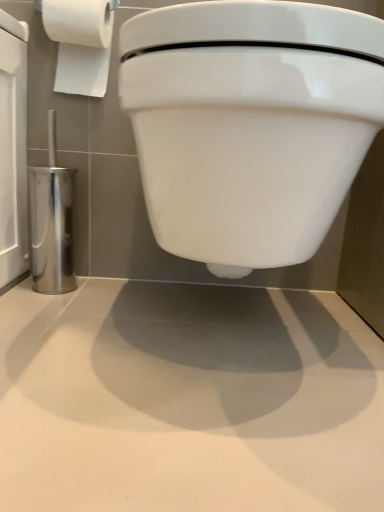
Where is `white paper at upper left`? The image size is (384, 512). white paper at upper left is located at coordinates (80, 42).

What do you see at coordinates (80, 42) in the screenshot? The width and height of the screenshot is (384, 512). I see `white paper at upper left` at bounding box center [80, 42].

Describe the element at coordinates (250, 124) in the screenshot. The width and height of the screenshot is (384, 512). I see `white glossy toilet at center` at that location.

Locate an element on the screen. white glossy toilet at center is located at coordinates (250, 124).

In order to face white glossy toilet at center, should I rotate leftwards or rightwards?

It's best to rotate right around 6.120 degrees.

I want to click on white paper at upper left, so click(x=80, y=42).

Considering the positions of objects white glossy toilet at center and white paper at upper left in the image provided, who is more to the left, white glossy toilet at center or white paper at upper left?

white paper at upper left is more to the left.

Which object is further away from the camera, white glossy toilet at center or white paper at upper left?

white paper at upper left is more distant.

From the picture: Which point is more distant from viewer, [235,96] or [90,19]?

The point [90,19] is behind.

From the image's perspective, is white glossy toilet at center above or below white paper at upper left?

white glossy toilet at center is situated lower than white paper at upper left in the image.

From a real-world perspective, who is located higher, white glossy toilet at center or white paper at upper left?

white paper at upper left.

Which of these two, white glossy toilet at center or white paper at upper left, is thinner?

Thinner between the two is white paper at upper left.

From their relative heights in the image, would you say white glossy toilet at center is taller or shorter than white paper at upper left?

In the image, white glossy toilet at center appears to be taller than white paper at upper left.

Is white glossy toilet at center bigger than white paper at upper left?

Correct, white glossy toilet at center is larger in size than white paper at upper left.

Is white glossy toilet at center completely or partially outside of white paper at upper left?

Indeed, white glossy toilet at center is completely outside white paper at upper left.

Is white glossy toilet at center next to white paper at upper left?

No, white glossy toilet at center is not with white paper at upper left.

Is white glossy toilet at center oriented away from white paper at upper left?

No, white paper at upper left is not at the back of white glossy toilet at center.

How different are the orientations of white glossy toilet at center and white paper at upper left in degrees?

The facing directions of white glossy toilet at center and white paper at upper left are 0.104 degrees apart.

I want to click on toilet paper above the white glossy toilet at center (from a real-world perspective), so click(80, 42).

In the image, is white paper at upper left on the left side or the right side of white glossy toilet at center?

From the image, it's evident that white paper at upper left is to the left of white glossy toilet at center.

Considering the relative positions of white paper at upper left and white glossy toilet at center in the image provided, is white paper at upper left in front of white glossy toilet at center?

No, white paper at upper left is further to the viewer.

Does point (88, 17) appear closer or farther from the camera than point (219, 221)?

Clearly, point (88, 17) is more distant from the camera than point (219, 221).

From the image's perspective, is white paper at upper left located above or below white glossy toilet at center?

From the image's perspective, white paper at upper left appears above white glossy toilet at center.

From a real-world perspective, relative to white glossy toilet at center, is white paper at upper left vertically above or below?

From a real-world perspective, white paper at upper left is physically above white glossy toilet at center.

Which object is wider, white paper at upper left or white glossy toilet at center?

Wider between the two is white glossy toilet at center.

Does white paper at upper left have a lesser height compared to white glossy toilet at center?

Correct, white paper at upper left is not as tall as white glossy toilet at center.

Which of these two, white paper at upper left or white glossy toilet at center, is smaller?

white paper at upper left is smaller.

Is white glossy toilet at center surrounded by white paper at upper left?

Actually, white glossy toilet at center is outside white paper at upper left.

Is white paper at upper left placed right next to white glossy toilet at center?

No, white paper at upper left is not next to white glossy toilet at center.

Looking at this image, is white paper at upper left oriented towards white glossy toilet at center?

No, white paper at upper left is not oriented towards white glossy toilet at center.

Identify the location of toilet in front of the white paper at upper left. This screenshot has width=384, height=512. (250, 124).

Image resolution: width=384 pixels, height=512 pixels. In order to click on toilet below the white paper at upper left (from the image's perspective) in this screenshot , I will do `click(250, 124)`.

In order to click on toilet paper that appears above the white glossy toilet at center (from a real-world perspective) in this screenshot , I will do `click(80, 42)`.